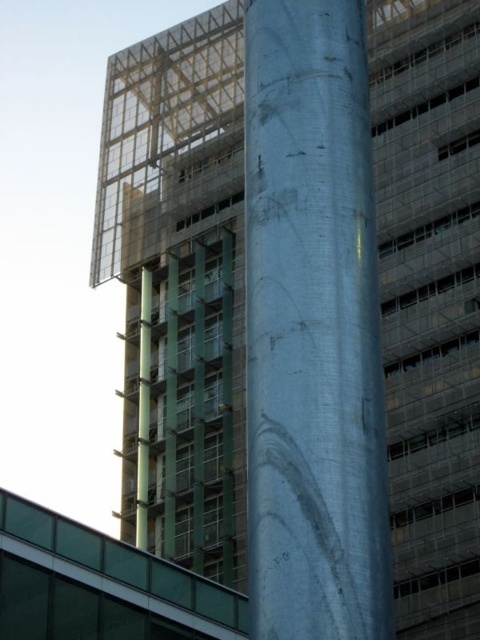
Can you confirm if metallic silver pole at center is smaller than green glass pole at center?

Yes, metallic silver pole at center is smaller than green glass pole at center.

Can you confirm if metallic silver pole at center is shorter than green glass pole at center?

Yes, metallic silver pole at center is shorter than green glass pole at center.

Is point (257, 193) in front of point (142, 416)?

That is True.

Where is `metallic silver pole at center`? This screenshot has height=640, width=480. metallic silver pole at center is located at coordinates (312, 328).